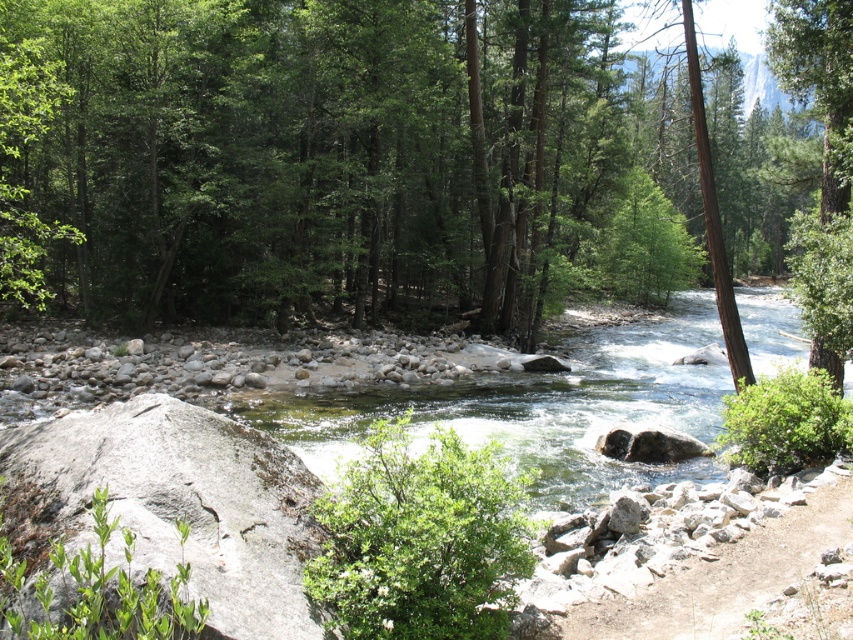
Does green leafy tree at center appear on the left side of brown rough tree trunk at right?

In fact, green leafy tree at center is to the right of brown rough tree trunk at right.

At what (x,y) coordinates should I click in order to perform the action: click on green leafy tree at center. Please return your answer as a coordinate pair (x, y). The height and width of the screenshot is (640, 853). Looking at the image, I should click on (373, 157).

In order to click on green leafy tree at center in this screenshot , I will do `click(373, 157)`.

Find the location of a particular element. Image resolution: width=853 pixels, height=640 pixels. green leafy tree at center is located at coordinates coord(373,157).

Measure the distance between green leafy tree at center and clear water at center.

green leafy tree at center is 15.88 meters from clear water at center.

Is point (553, 115) positioned before point (579, 483)?

No, (553, 115) is further to viewer.

Measure the distance between point (366, 244) and camera.

Point (366, 244) and camera are 36.37 meters apart from each other.

Where is `green leafy tree at center`? The height and width of the screenshot is (640, 853). green leafy tree at center is located at coordinates (373, 157).

Which is more to the right, clear water at center or brown rough tree trunk at right?

clear water at center is more to the right.

This screenshot has width=853, height=640. I want to click on clear water at center, so click(538, 406).

Find the location of a particular element. This screenshot has height=640, width=853. clear water at center is located at coordinates (538, 406).